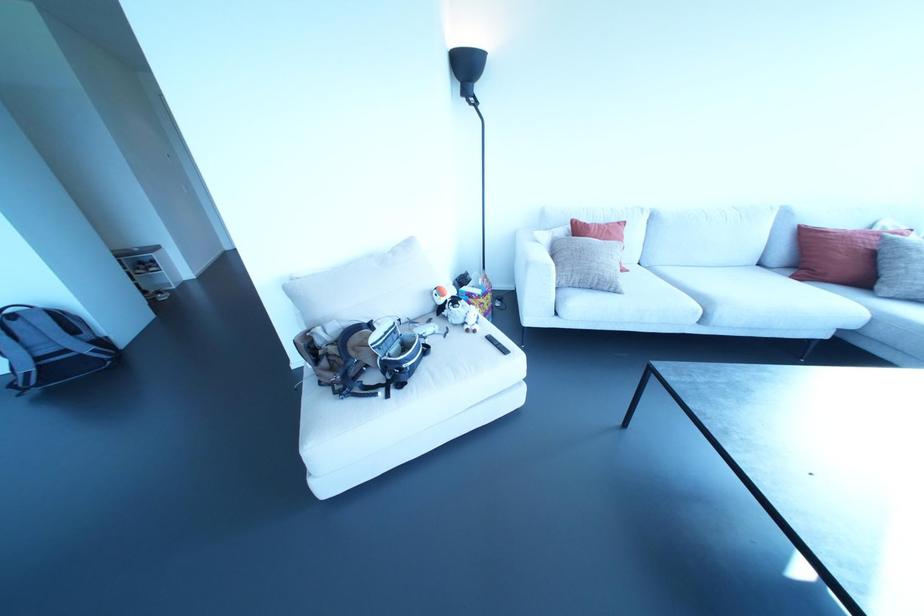
At what (x,y) coordinates should I click in order to perform the action: click on black remote control. Please return your answer as a coordinate pair (x, y). Looking at the image, I should click on (496, 344).